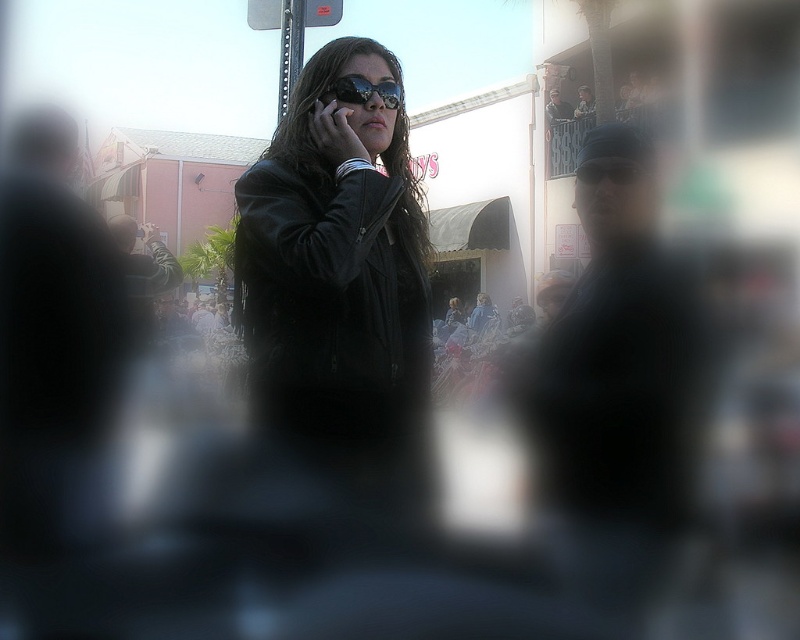
You are a photographer trying to adjust the focus of your camera to capture the black leather jacket at center and the sunglasses at center. Which object should you focus on first if you want to ensure both are in focus, considering their positions?

The black leather jacket at center is below sunglasses at center, so you should focus on the sunglasses at center first to ensure both are in focus since they are at different distances from the camera.

You are a photographer trying to capture a clear photo of the black leather jacket at center and the black matte smartphone at center. Since the camera lens in the foreground is causing some blur, which object should you focus on to ensure it appears clearer in the final image?

The black leather jacket at center should be focused on because it is positioned on the right side of the black matte smartphone at center, so it is closer to the camera lens and less obscured by the blur.

You are a photographer trying to capture a closeup shot of the sunglasses at center and the black matte smartphone at center in the scene. Given that your camera can only focus on objects within a 5 cm range, will both items be in focus?

The sunglasses at center and black matte smartphone at center are 8.32 centimeters apart from each other. Since the camera can only focus on objects within a 5 cm range, the distance between them exceeds this limit, so both items cannot be in focus simultaneously.